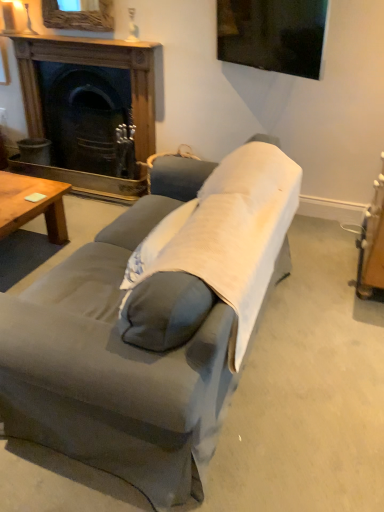
You are a GUI agent. You are given a task and a screenshot of the screen. Output one action in this format:
    pyautogui.click(x=<x>, y=<y>)
    Task: Click on the free spot above wooden coffee table at lower left (from a real-world perspective)
    
    Given the screenshot: What is the action you would take?
    pyautogui.click(x=16, y=192)